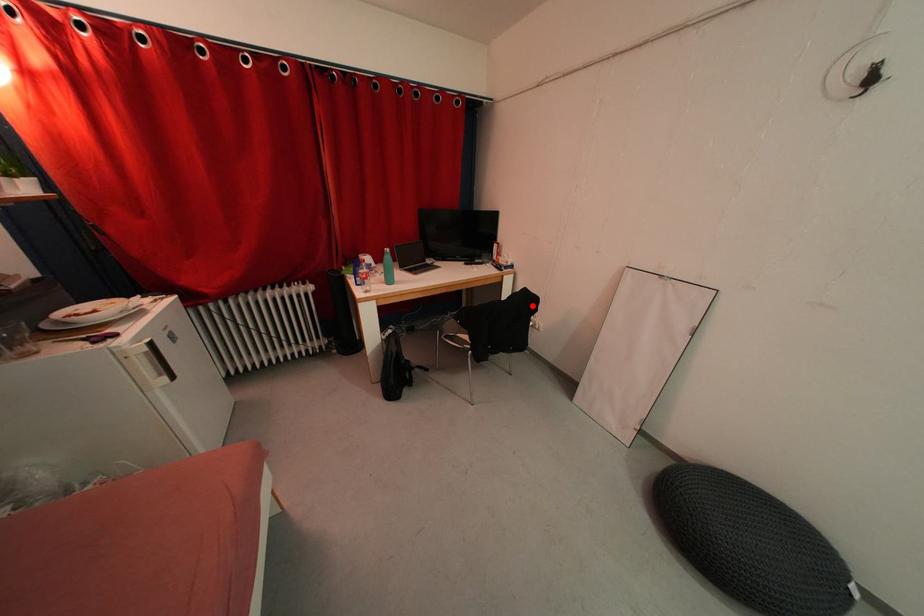
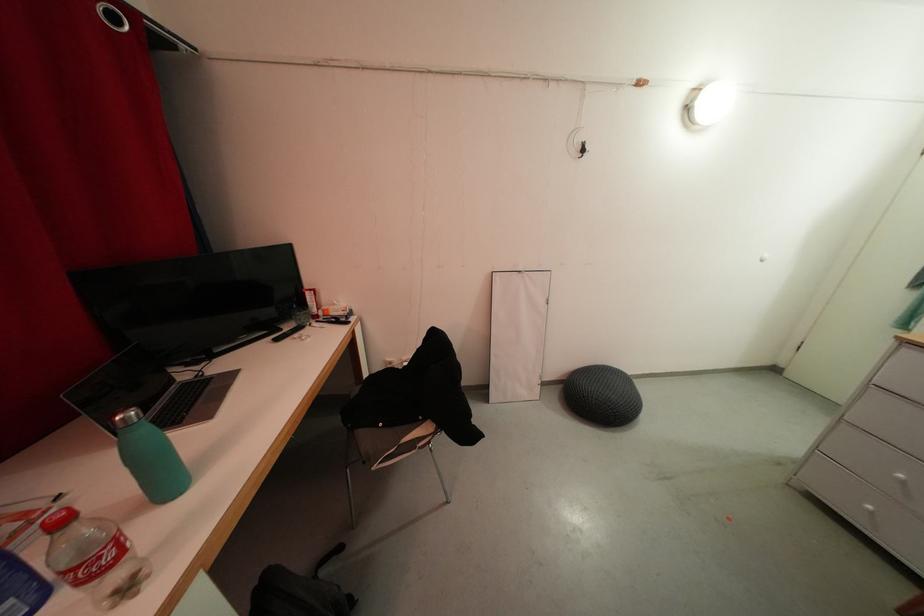
In the second image, find the point that corresponds to the highlighted location in the first image.

(441, 345)